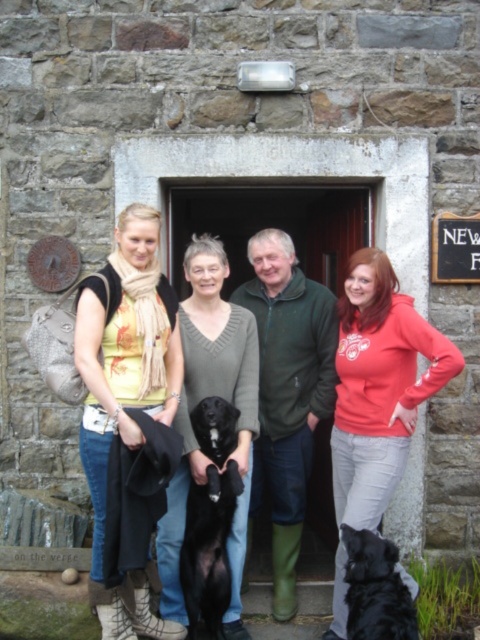
Question: Which object is the closest to the matte red hoodie at center?

Choices:
 (A) shiny black fur at center
 (B) knitted gray sweater at center
 (C) black glossy dog at center
 (D) green matte jacket at center

Answer: (D)

Question: Can you confirm if matte yellow top at center is positioned above matte red hoodie at center?

Choices:
 (A) yes
 (B) no

Answer: (A)

Question: Is matte yellow top at center to the left of shiny black fur at center from the viewer's perspective?

Choices:
 (A) yes
 (B) no

Answer: (A)

Question: Is matte black dog at center further to camera compared to matte red hoodie at center?

Choices:
 (A) yes
 (B) no

Answer: (B)

Question: Which of the following is the farthest from the observer?

Choices:
 (A) (240, 451)
 (B) (398, 595)

Answer: (A)

Question: Among these points, which one is farthest from the camera?

Choices:
 (A) (335, 589)
 (B) (155, 333)
 (C) (395, 616)
 (D) (188, 536)

Answer: (A)